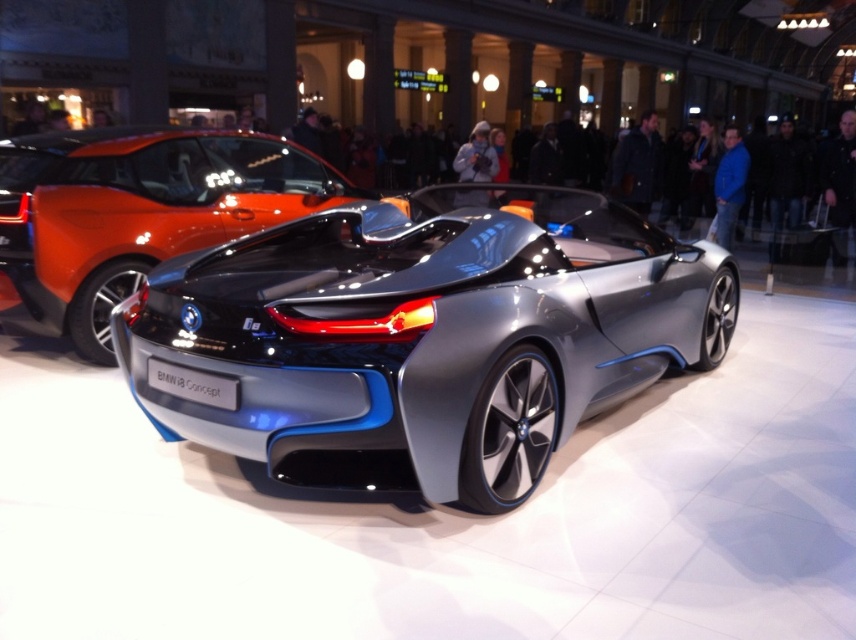
You are at an auto show and see two cars displayed. The first is a sleek metallic car at center, and the second is a shiny metallic car at center. Which car is positioned lower in the image?

The sleek metallic car at center is located below the shiny metallic car at center, so it is positioned lower in the image.

You are at an auto show and want to take a photo of both the sleek metallic car at center and the shiny metallic car at center. Which car should you focus on first to ensure both fit in the frame?

You should focus on the sleek metallic car at center first since it is larger and will require more space in the frame to capture fully, ensuring both cars can be included.

You are standing at the point with coordinates closest to the car in the background. Which of the two points, point (544, 202) or point (6, 144), is closer to you?

Point (6, 144) is closer to you because it is behind point (544, 202), meaning it is nearer to your position at the background car.